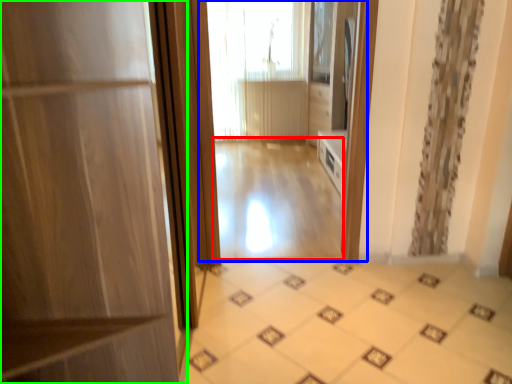
Question: Which object is the closest to the corridor (highlighted by a red box)? Choose among these: residence (highlighted by a blue box) or door (highlighted by a green box).

Choices:
 (A) residence
 (B) door

Answer: (A)